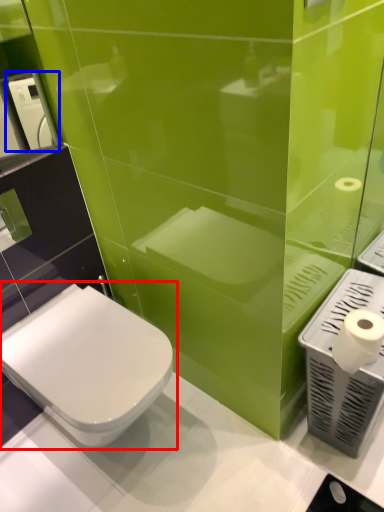
Question: Which point is closer to the camera, toilet (highlighted by a red box) or hand dryer (highlighted by a blue box)?

Choices:
 (A) toilet
 (B) hand dryer

Answer: (A)